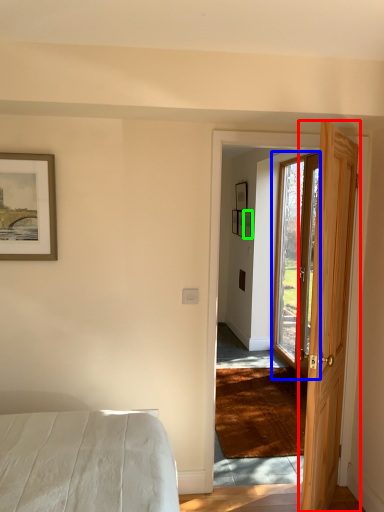
Question: Which object is the closest to the door (highlighted by a red box)? Choose among these: door (highlighted by a blue box) or picture frame (highlighted by a green box).

Choices:
 (A) door
 (B) picture frame

Answer: (A)